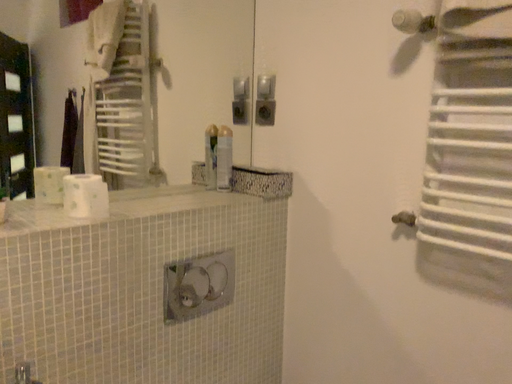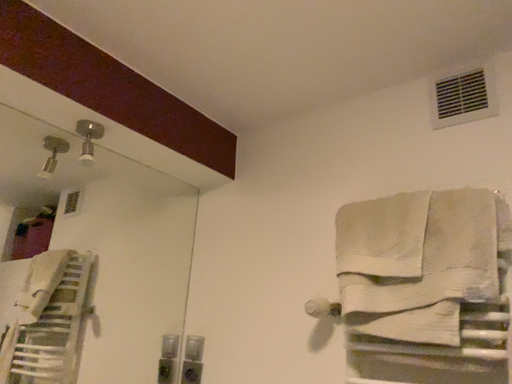
Question: How did the camera likely rotate when shooting the video?

Choices:
 (A) rotated downward
 (B) rotated upward

Answer: (B)